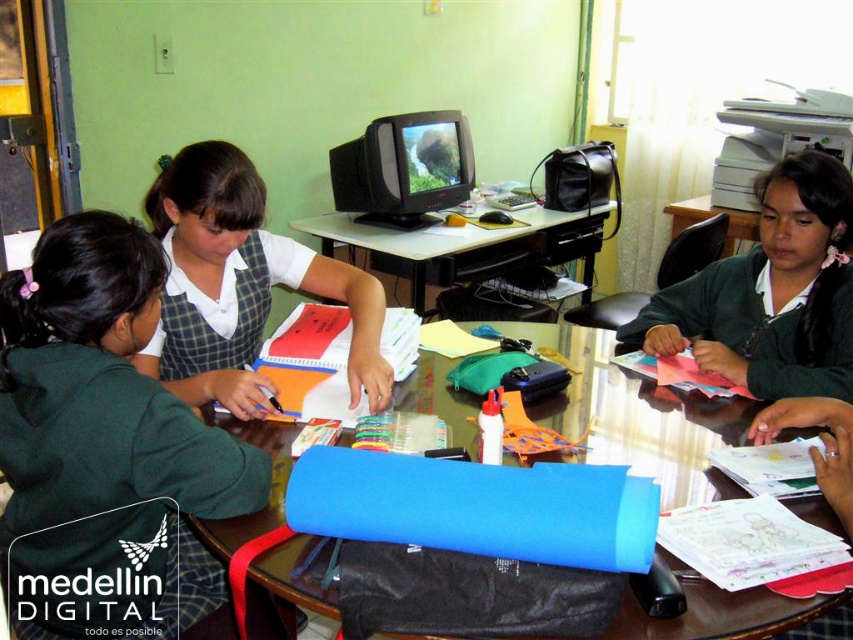
Is point (817, 161) closer to viewer compared to point (389, 211)?

Yes, point (817, 161) is closer to viewer.

Which is behind, point (766, 262) or point (363, 160)?

The point (363, 160) is more distant.

Locate an element on the screen. This screenshot has width=853, height=640. green matte uniform at center is located at coordinates (770, 292).

Can you confirm if white glossy table at center is bigger than transparent plastic table at center?

Correct, white glossy table at center is larger in size than transparent plastic table at center.

Can you confirm if white glossy table at center is positioned below transparent plastic table at center?

Yes.

Is point (489, 252) behind point (751, 232)?

Yes, point (489, 252) is behind point (751, 232).

Find the location of a particular element. Image resolution: width=853 pixels, height=640 pixels. white glossy table at center is located at coordinates [469, 244].

Between green fabric at left and blue fabric at center, which one is positioned higher?

Positioned higher is blue fabric at center.

Describe the element at coordinates (107, 440) in the screenshot. I see `green fabric at left` at that location.

Is point (73, 417) behind point (669, 496)?

That is False.

At what (x,y) coordinates should I click in order to perform the action: click on green fabric at left. Please return your answer as a coordinate pair (x, y). Looking at the image, I should click on (107, 440).